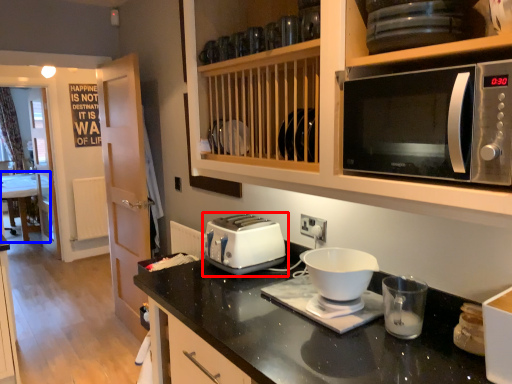
Question: Which of the following is the farthest to the observer, toaster (highlighted by a red box) or table (highlighted by a blue box)?

Choices:
 (A) toaster
 (B) table

Answer: (B)